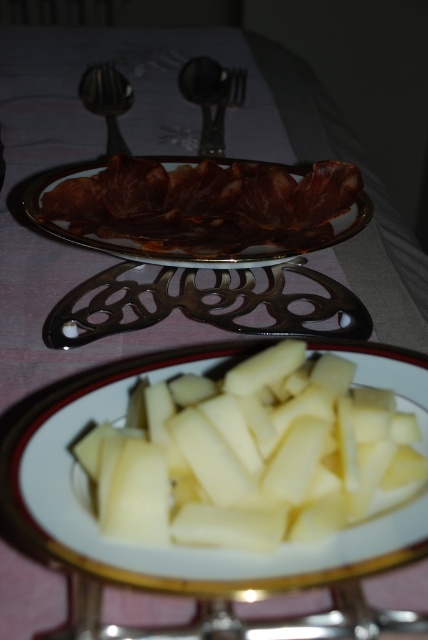
You are a food critic who needs to take a closeup photo of the white glossy plate at center. Where should you position your camera to capture the plate without any obstructions?

Position the camera directly above the white glossy plate at center at point coordinates approximately 0.731 on the x axis and 0.533 on the y axis to ensure a clear, unobstructed view.

You are a diner at the table. You want to pick up the shiny silver spoon at upper left to eat the matte brown plate at center. Can you reach the spoon without moving your hand from the plate?

The matte brown plate at center is below the shiny silver spoon at upper left, so yes, you can reach the spoon by extending your hand upward from the plate.

You are a guest at a dinner party and want to reach for the shiny silver spoon at upper left to taste the food on the white glossy plate at center. Based on their positions, can you easily grab the spoon without moving the plate?

The white glossy plate at center is to the right of the shiny silver spoon at upper left, so you can easily reach the spoon without disturbing the plate since they are positioned side by side.